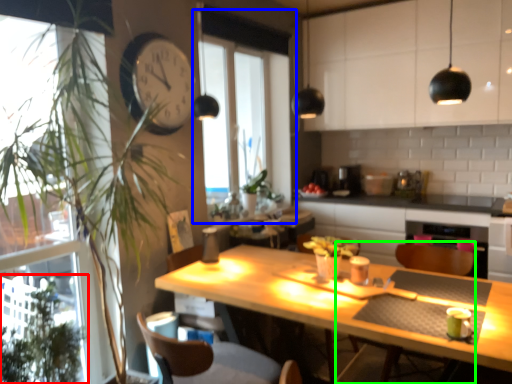
Question: Based on their relative distances, which object is nearer to plant (highlighted by a red box)? Choose from window (highlighted by a blue box) and armchair (highlighted by a green box).

Choices:
 (A) window
 (B) armchair

Answer: (B)